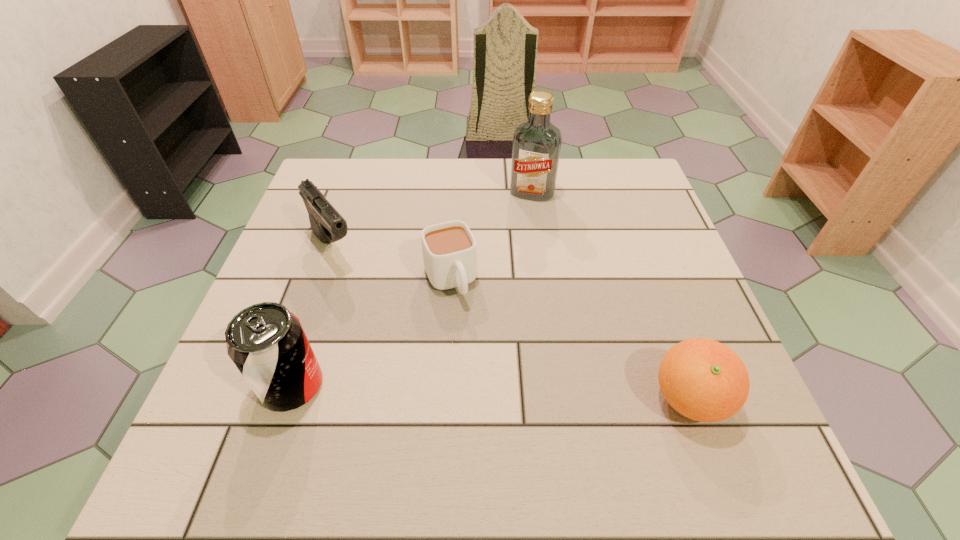
Find the location of a particular element. This screenshot has height=540, width=960. soda can located at the near edge is located at coordinates (266, 342).

This screenshot has height=540, width=960. What are the coordinates of `orange present at the near edge` in the screenshot? It's located at (704, 380).

At what (x,y) coordinates should I click in order to perform the action: click on soda can that is positioned at the left edge. Please return your answer as a coordinate pair (x, y). This screenshot has width=960, height=540. Looking at the image, I should click on (266, 342).

Where is `pistol that is at the left edge`? The height and width of the screenshot is (540, 960). pistol that is at the left edge is located at coordinates (327, 224).

This screenshot has width=960, height=540. In order to click on object that is at the right edge in this screenshot , I will do `click(704, 380)`.

Image resolution: width=960 pixels, height=540 pixels. I want to click on object at the near left corner, so click(x=266, y=342).

Identify the location of object present at the near right corner. This screenshot has height=540, width=960. (704, 380).

The image size is (960, 540). Identify the location of vacant space at the far edge. (435, 185).

In the image, there is a desktop. Find the location of `vacant space at the left edge`. vacant space at the left edge is located at coordinates (293, 309).

In the image, there is a desktop. Where is `vacant space at the right edge`? vacant space at the right edge is located at coordinates (605, 231).